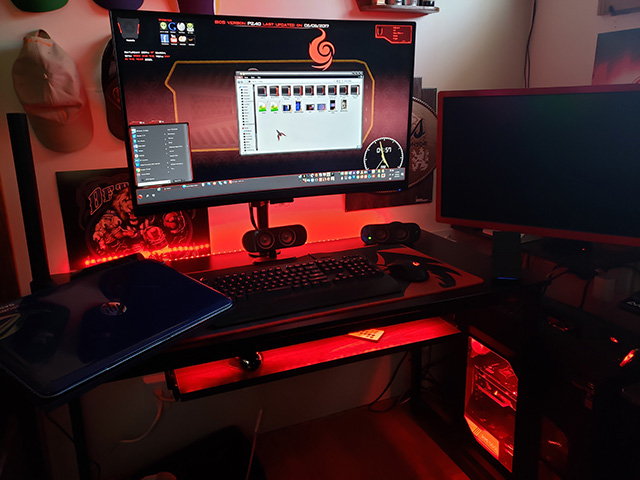
Find the location of a particular element. This screenshot has height=480, width=640. monitor is located at coordinates (278, 147), (491, 200).